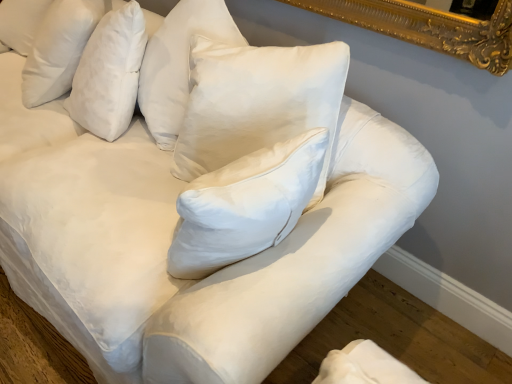
This screenshot has width=512, height=384. Describe the element at coordinates (59, 48) in the screenshot. I see `white soft pillow at upper left` at that location.

Identify the location of white soft pillow at upper left. The height and width of the screenshot is (384, 512). point(59,48).

Identify the location of white soft pillow at upper left. The image size is (512, 384). (59, 48).